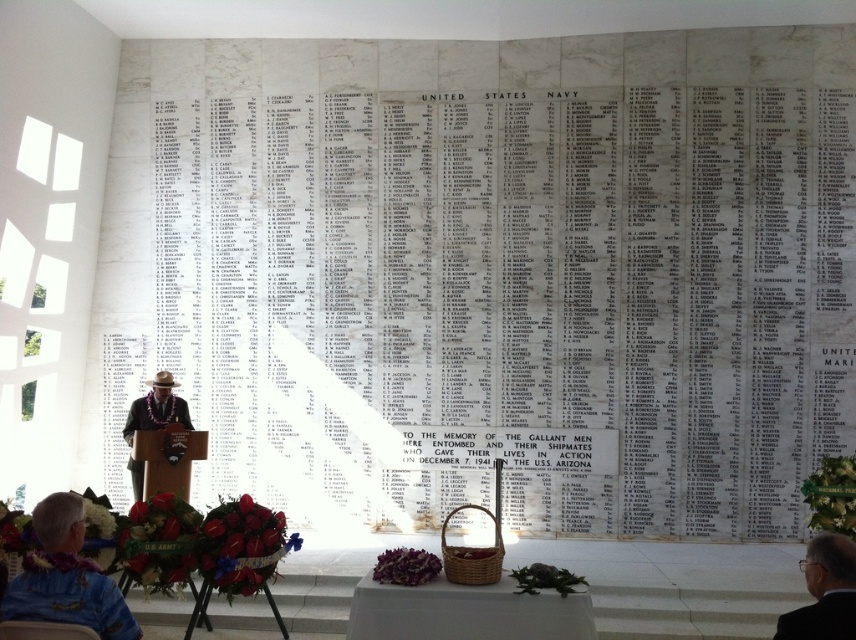
You are attending a memorial service and need to place a wreath on the table. Which object should you approach first, the white fabric table at center or the wooden chair at lower left?

You should approach the white fabric table at center first because it is located below the wooden chair at lower left, meaning it is closer to you.